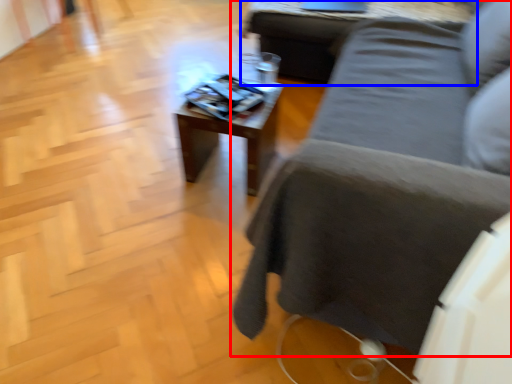
Question: Among these objects, which one is farthest to the camera, studio couch (highlighted by a red box) or table (highlighted by a blue box)?

Choices:
 (A) studio couch
 (B) table

Answer: (B)